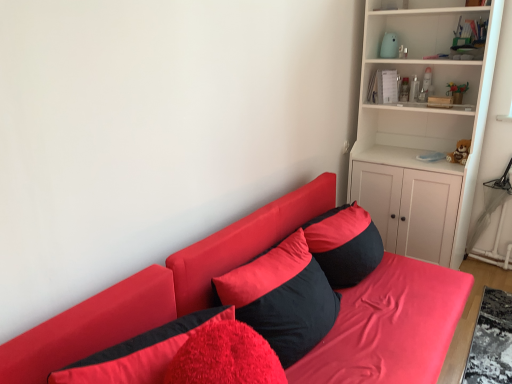
Question: Is matte red couch at center positioned beyond the bounds of velvet red pillow at lower left, acting as the 3th pillow starting from the back?

Choices:
 (A) yes
 (B) no

Answer: (A)

Question: Considering the relative sizes of matte red couch at center and velvet red pillow at lower left, which is counted as the 1th pillow, starting from the front, in the image provided, is matte red couch at center taller than velvet red pillow at lower left, which is counted as the 1th pillow, starting from the front,?

Choices:
 (A) yes
 (B) no

Answer: (A)

Question: Does matte red couch at center have a lesser height compared to velvet red pillow at lower left, acting as the 3th pillow starting from the back?

Choices:
 (A) no
 (B) yes

Answer: (A)

Question: Considering the relative sizes of matte red couch at center and velvet red pillow at lower left, which is counted as the 1th pillow, starting from the front, in the image provided, is matte red couch at center bigger than velvet red pillow at lower left, which is counted as the 1th pillow, starting from the front,?

Choices:
 (A) no
 (B) yes

Answer: (B)

Question: Is matte red couch at center to the right of velvet red pillow at lower left, acting as the 3th pillow starting from the back, from the viewer's perspective?

Choices:
 (A) yes
 (B) no

Answer: (A)

Question: From a real-world perspective, is black matte pillow at center, acting as the 1th pillow starting from the back, physically located above or below matte red couch at center?

Choices:
 (A) above
 (B) below

Answer: (A)

Question: Looking at the image, does black matte pillow at center, which is the 3th pillow from front to back, seem bigger or smaller compared to matte red couch at center?

Choices:
 (A) small
 (B) big

Answer: (A)

Question: Considering the positions of black matte pillow at center, acting as the 1th pillow starting from the back, and matte red couch at center in the image, is black matte pillow at center, acting as the 1th pillow starting from the back, wider or thinner than matte red couch at center?

Choices:
 (A) thin
 (B) wide

Answer: (A)

Question: From the image's perspective, is black matte pillow at center, acting as the 1th pillow starting from the back, located above or below matte red couch at center?

Choices:
 (A) below
 (B) above

Answer: (B)

Question: Is point (365, 360) closer or farther from the camera than point (49, 374)?

Choices:
 (A) farther
 (B) closer

Answer: (A)

Question: Considering the positions of matte red couch at center and velvet red pillow at lower left, which is counted as the 1th pillow, starting from the front, in the image, is matte red couch at center taller or shorter than velvet red pillow at lower left, which is counted as the 1th pillow, starting from the front,?

Choices:
 (A) short
 (B) tall

Answer: (B)

Question: Relative to velvet red pillow at lower left, acting as the 3th pillow starting from the back, is matte red couch at center in front or behind?

Choices:
 (A) behind
 (B) front

Answer: (B)

Question: From a real-world perspective, is matte red couch at center above or below velvet red pillow at lower left, which is counted as the 1th pillow, starting from the front?

Choices:
 (A) above
 (B) below

Answer: (B)

Question: From the image's perspective, is velvet black pillow at center, which ranks as the 2th pillow in back-to-front order, positioned above or below matte red couch at center?

Choices:
 (A) below
 (B) above

Answer: (B)

Question: Relative to matte red couch at center, is velvet black pillow at center, which ranks as the 2th pillow in back-to-front order, in front or behind?

Choices:
 (A) behind
 (B) front

Answer: (A)